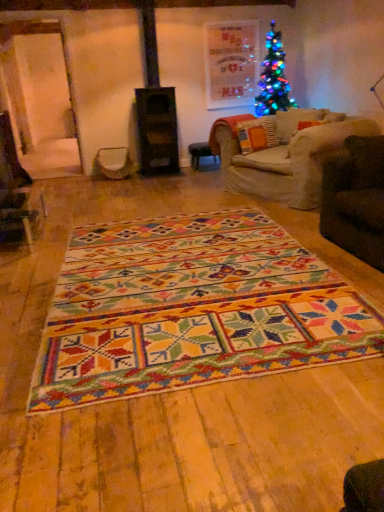
Question: Is wooden stool at center touching metallic silver swivel chair at center?

Choices:
 (A) no
 (B) yes

Answer: (A)

Question: Can you confirm if wooden stool at center is wider than metallic silver swivel chair at center?

Choices:
 (A) yes
 (B) no

Answer: (A)

Question: Is wooden stool at center oriented away from metallic silver swivel chair at center?

Choices:
 (A) yes
 (B) no

Answer: (B)

Question: From a real-world perspective, does wooden stool at center stand above metallic silver swivel chair at center?

Choices:
 (A) no
 (B) yes

Answer: (A)

Question: Considering the relative positions of wooden stool at center and metallic silver swivel chair at center in the image provided, is wooden stool at center to the left of metallic silver swivel chair at center from the viewer's perspective?

Choices:
 (A) no
 (B) yes

Answer: (A)

Question: Can you confirm if wooden stool at center is smaller than metallic silver swivel chair at center?

Choices:
 (A) yes
 (B) no

Answer: (A)

Question: Does textured orange pillow at center appear on the left side of metallic silver swivel chair at center?

Choices:
 (A) yes
 (B) no

Answer: (B)

Question: Is the surface of textured orange pillow at center in direct contact with metallic silver swivel chair at center?

Choices:
 (A) yes
 (B) no

Answer: (B)

Question: Does textured orange pillow at center lie in front of metallic silver swivel chair at center?

Choices:
 (A) yes
 (B) no

Answer: (A)

Question: From the image's perspective, is textured orange pillow at center under metallic silver swivel chair at center?

Choices:
 (A) yes
 (B) no

Answer: (B)

Question: Is textured orange pillow at center wider than metallic silver swivel chair at center?

Choices:
 (A) yes
 (B) no

Answer: (B)

Question: Does textured orange pillow at center have a lesser height compared to metallic silver swivel chair at center?

Choices:
 (A) no
 (B) yes

Answer: (A)

Question: From the image's perspective, is wooden stool at center located beneath multicolored woven rug at center?

Choices:
 (A) yes
 (B) no

Answer: (B)